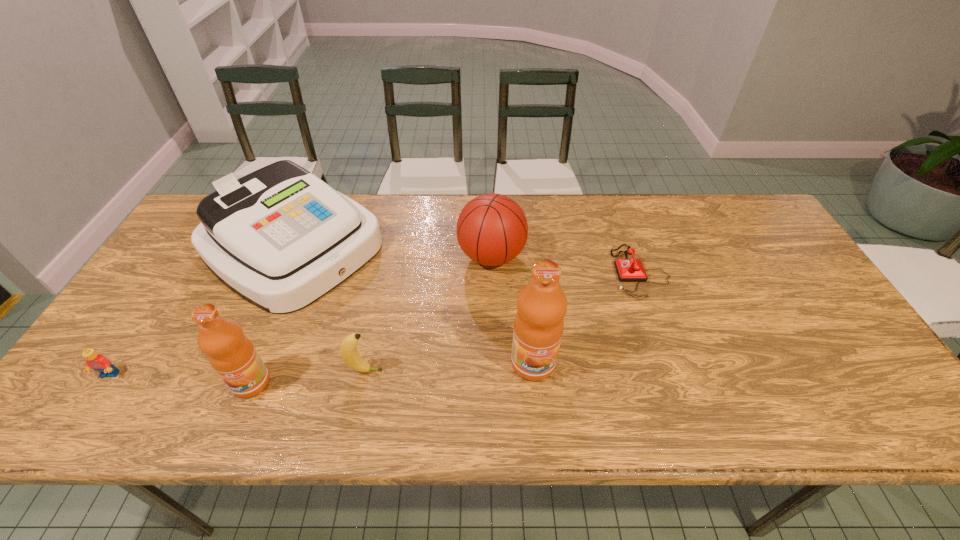
The height and width of the screenshot is (540, 960). In order to click on the shorter fruit juice in this screenshot , I will do `click(233, 356)`.

Where is `the tallest object`? This screenshot has height=540, width=960. the tallest object is located at coordinates (541, 304).

You are a GUI agent. You are given a task and a screenshot of the screen. Output one action in this format:
    pyautogui.click(x=<x>, y=<y>)
    Task: Click on the taller fruit juice
    
    Given the screenshot: What is the action you would take?
    pyautogui.click(x=541, y=304)

The width and height of the screenshot is (960, 540). I want to click on cash register, so click(x=280, y=238).

In order to click on telephone in this screenshot , I will do `click(628, 270)`.

The image size is (960, 540). What are the coordinates of `the shortest object` in the screenshot? It's located at (628, 270).

Find the location of a particular element. This screenshot has height=540, width=960. basketball is located at coordinates [x=492, y=229].

Locate an element on the screen. This screenshot has width=960, height=540. the second shortest object is located at coordinates (98, 362).

You are a GUI agent. You are given a task and a screenshot of the screen. Output one action in this format:
    pyautogui.click(x=<x>, y=<y>)
    Task: Click on the leftmost object
    Image resolution: width=960 pixels, height=540 pixels.
    Given the screenshot: What is the action you would take?
    pyautogui.click(x=98, y=362)

The width and height of the screenshot is (960, 540). I want to click on banana, so click(348, 349).